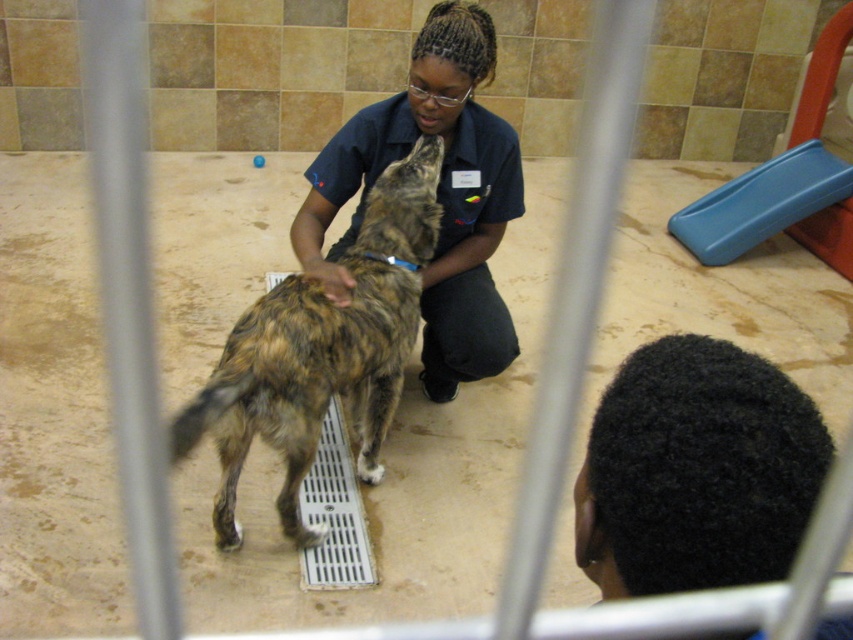
Question: Can you confirm if brown fur dog at center is bigger than dark blue uniform at center?

Choices:
 (A) no
 (B) yes

Answer: (A)

Question: Which object is closer to the camera taking this photo?

Choices:
 (A) dark blue uniform at center
 (B) brown fur dog at center

Answer: (B)

Question: Which point is farther to the camera?

Choices:
 (A) (413, 205)
 (B) (442, 348)

Answer: (B)

Question: Is the position of brown fur dog at center more distant than that of dark blue uniform at center?

Choices:
 (A) no
 (B) yes

Answer: (A)

Question: Is brown fur dog at center wider than dark blue uniform at center?

Choices:
 (A) no
 (B) yes

Answer: (A)